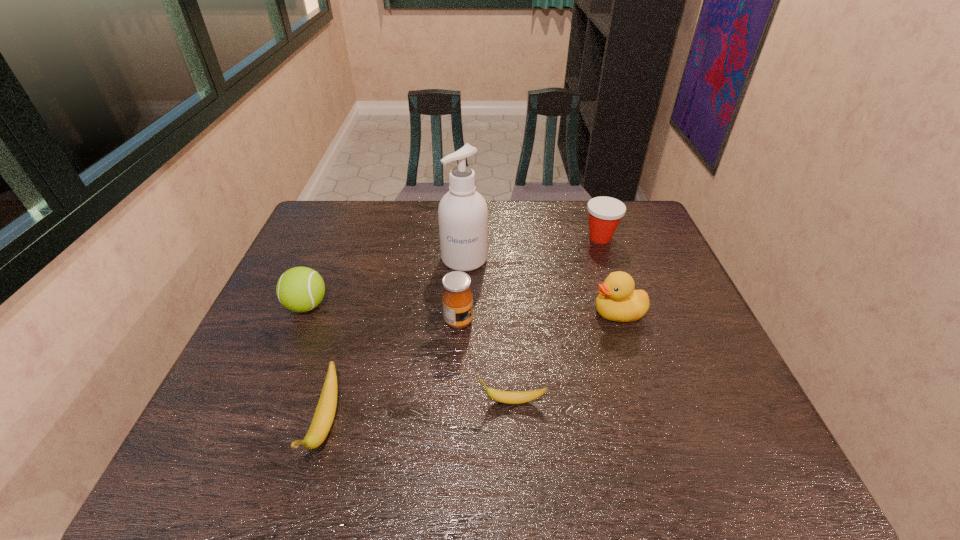
Identify the location of blank space that satisfies the following two spatial constraints: 1. at the stem of the shortest object; 2. at the stem of the second object from left to right. The height and width of the screenshot is (540, 960). (513, 423).

Locate an element on the screen. vacant region that satisfies the following two spatial constraints: 1. on the front label of the tallest object; 2. on the front-facing side of the honey is located at coordinates (462, 321).